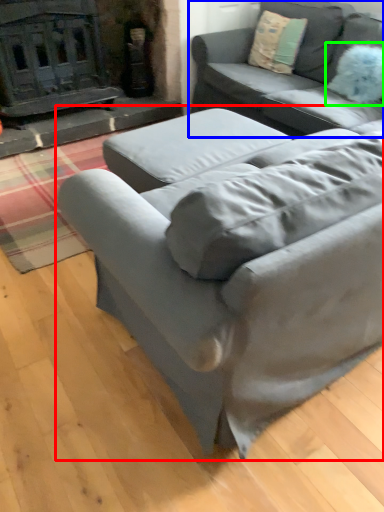
Question: Considering the real-world distances, which object is farthest from studio couch (highlighted by a red box)? studio couch (highlighted by a blue box) or pillow (highlighted by a green box)?

Choices:
 (A) studio couch
 (B) pillow

Answer: (B)